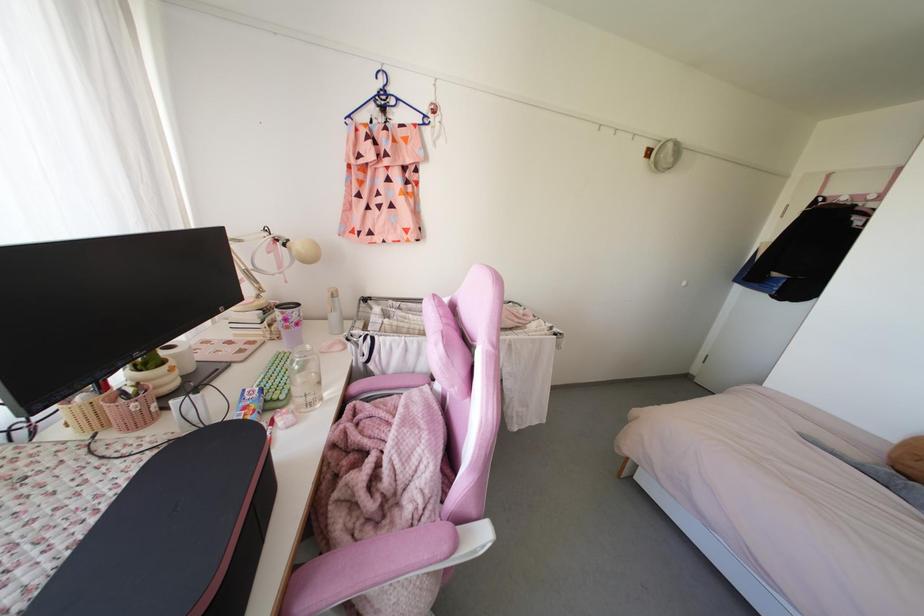
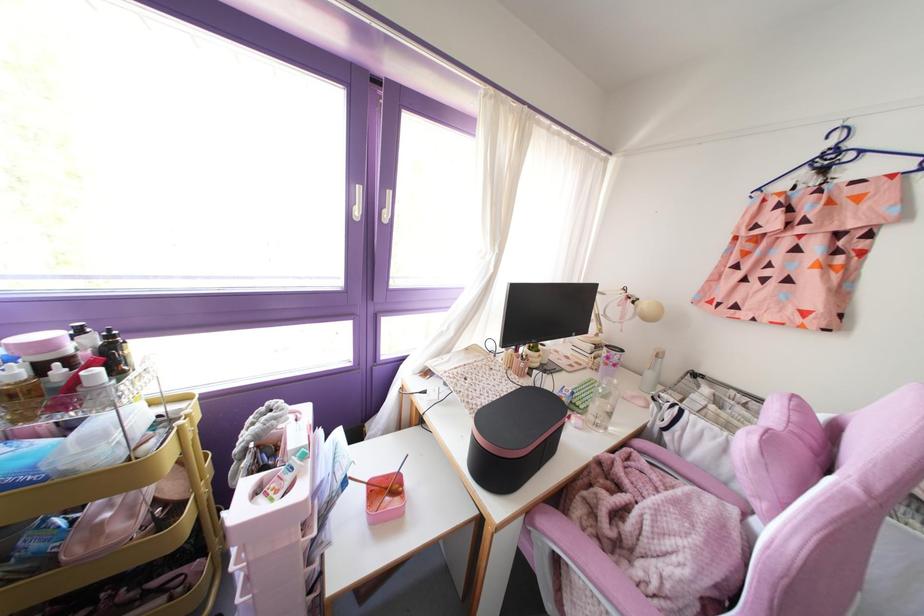
Find the pixel in the second image that matches pixel 307 346 in the first image.

(614, 381)